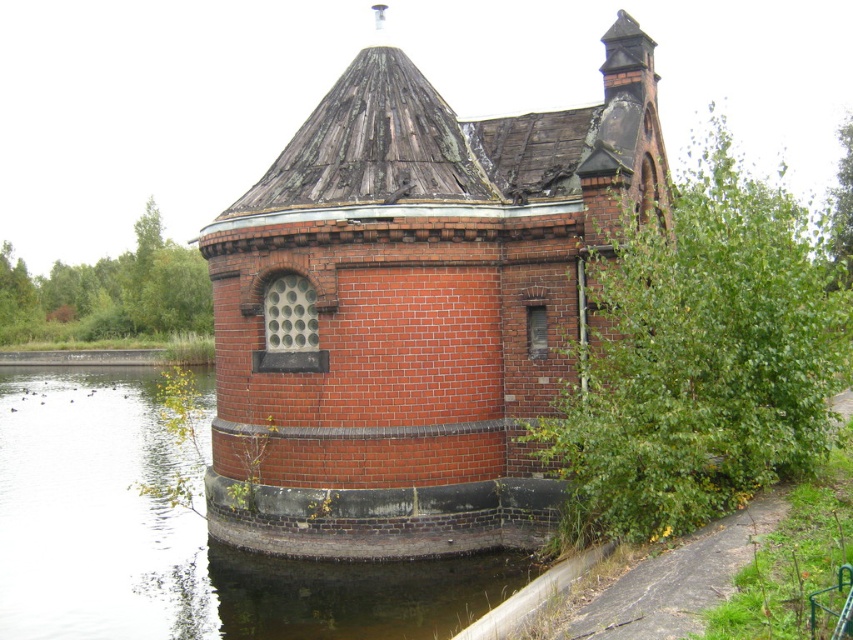
You are standing at the edge of a pond and see the red brick tower at center. If you walk straight towards it for 15 meters, will you reach the tower?

The distance between you and the red brick tower at center is 18.00 meters. After walking 15 meters, you will still be 3 meters away from the tower, so you have not reached it yet.

You are standing 20 meters away from the small, round brick structure. A point labeled as point (564, 115) is located on the structure. Can you reach that point without moving closer than your current position?

The distance of point (564, 115) from viewer is 22.00 meters. Since you are currently 20 meters away from the structure, you would need to move 2 meters further away to reach the point, which is beyond your current position. Therefore, you cannot reach the point without moving closer or farther away.

You are standing at the origin point of the coordinate system in the image, which is the bottom left corner. You want to walk directly to the red brick tower at center. In which direction should you move first?

Since the red brick tower at center is located at coordinates approximately 0.484 on both the x and y axes, you should move diagonally northeast to reach it from the origin point at the bottom left corner.